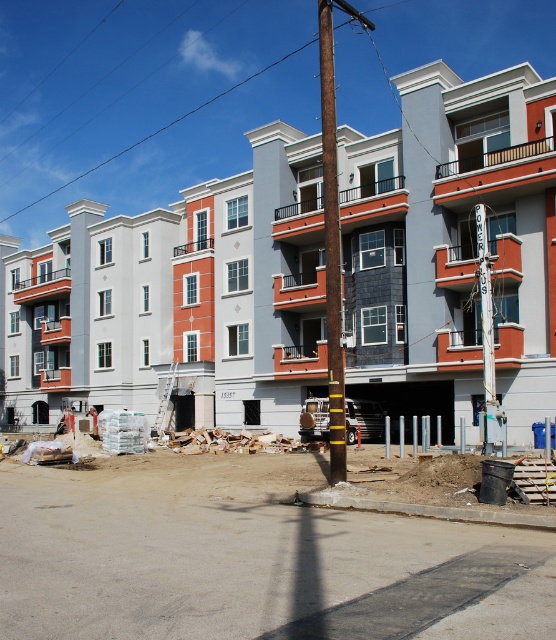
In order to click on white hard hat at center in this screenshot , I will do `click(64, 422)`.

The width and height of the screenshot is (556, 640). I want to click on white hard hat at center, so click(x=64, y=422).

Does dirt at lower center have a lesser width compared to rusty metal pole at center?

Yes, dirt at lower center is thinner than rusty metal pole at center.

Who is positioned more to the right, dirt at lower center or rusty metal pole at center?

rusty metal pole at center is more to the right.

What do you see at coordinates (246, 557) in the screenshot? I see `dirt at lower center` at bounding box center [246, 557].

Find the location of a particular element. The height and width of the screenshot is (640, 556). dirt at lower center is located at coordinates (246, 557).

Between point (459, 356) and point (62, 413), which one is positioned in front?

Point (459, 356)

Image resolution: width=556 pixels, height=640 pixels. What do you see at coordinates (180, 301) in the screenshot?
I see `white concrete building at upper center` at bounding box center [180, 301].

Measure the distance between point (415, 72) and camera.

Point (415, 72) and camera are 100.98 feet apart.

This screenshot has width=556, height=640. I want to click on white concrete building at upper center, so (180, 301).